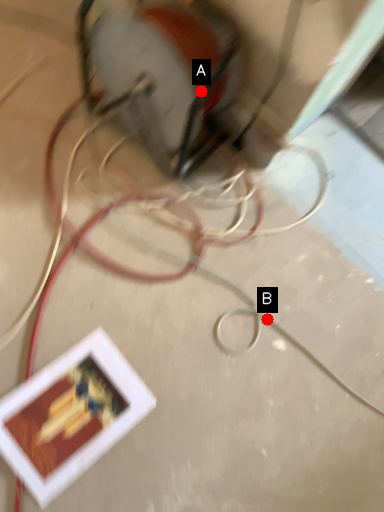
Question: Two points are circled on the image, labeled by A and B beside each circle. Among these points, which one is nearest to the camera?

Choices:
 (A) A is closer
 (B) B is closer

Answer: (A)